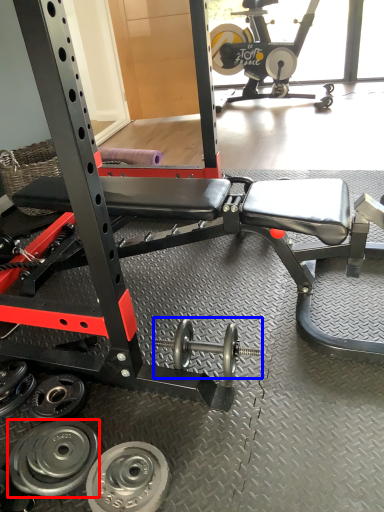
Question: Among these objects, which one is farthest to the camera, wheel (highlighted by a red box) or dumbbell (highlighted by a blue box)?

Choices:
 (A) wheel
 (B) dumbbell

Answer: (B)